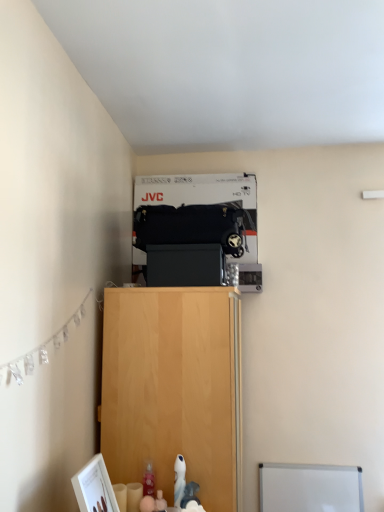
The image size is (384, 512). I want to click on light wood cabinet at center, so click(x=173, y=389).

The image size is (384, 512). Describe the element at coordinates (173, 389) in the screenshot. I see `light wood cabinet at center` at that location.

Find the location of a particular element. The image size is (384, 512). light wood cabinet at center is located at coordinates (173, 389).